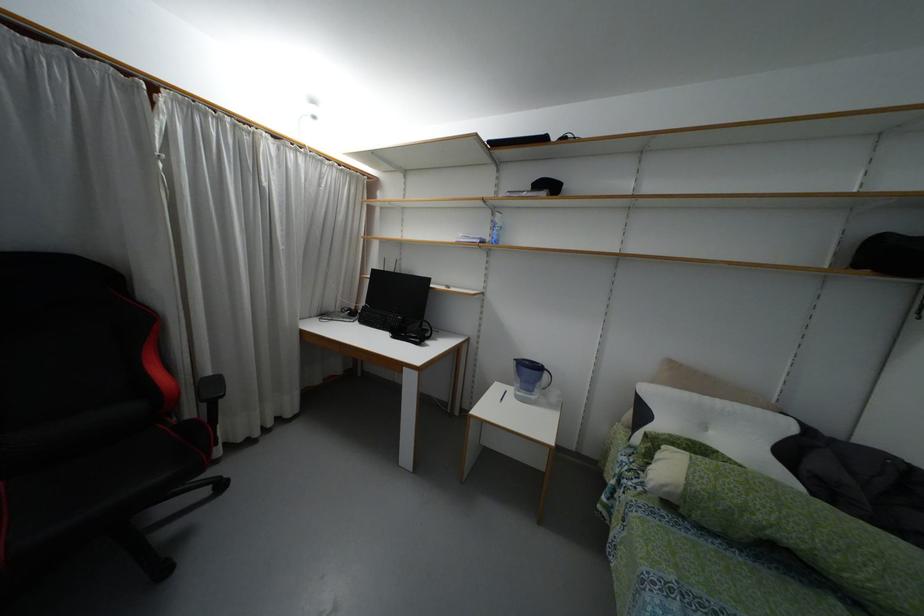
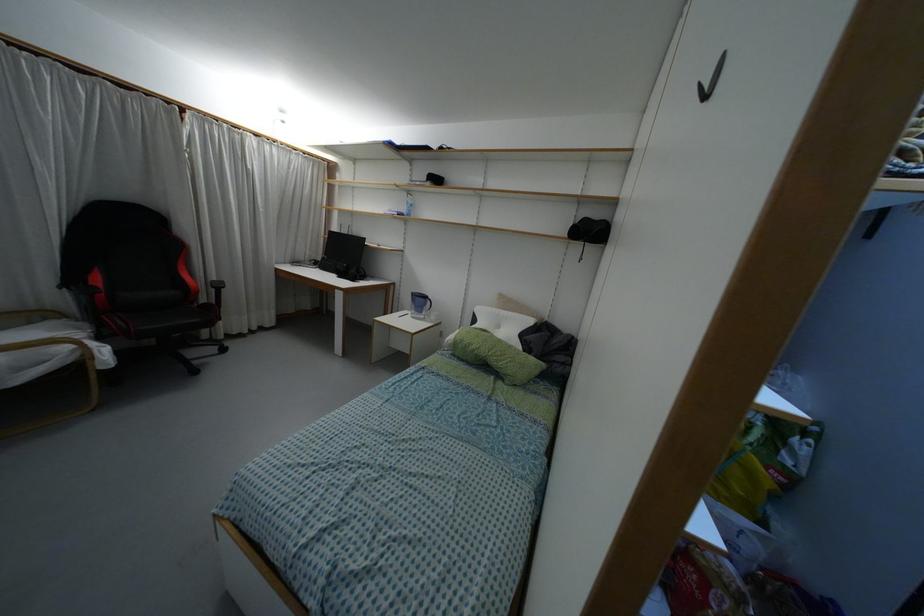
Locate, in the second image, the point that corresponds to (x=544, y=375) in the first image.

(428, 302)